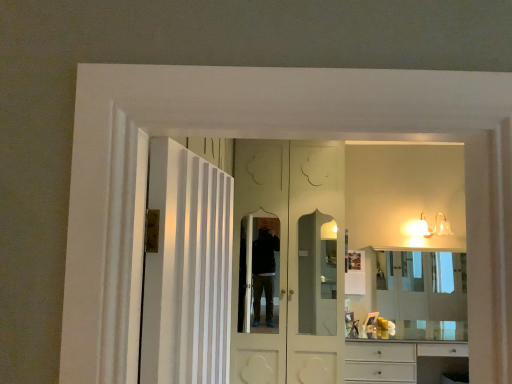
What is the approximate height of white glossy door at center, arranged as the second door when viewed from the back?

It is 33.82 inches.

In order to click on white glossy door at center, arranged as the second door when viewed from the back in this screenshot , I will do `click(187, 270)`.

Measure the distance between white glossy wall sconce at upper right and camera.

A distance of 14.91 feet exists between white glossy wall sconce at upper right and camera.

Identify the location of white glossy door at center, marked as the first door in a front-to-back arrangement. (187, 270).

Between white glossy wall sconce at upper right and white glossy door at center, marked as the first door in a front-to-back arrangement, which one is positioned behind?

white glossy wall sconce at upper right is further away from the camera.

Is white glossy wall sconce at upper right bigger or smaller than white glossy door at center, marked as the first door in a front-to-back arrangement?

Clearly, white glossy wall sconce at upper right is smaller in size than white glossy door at center, marked as the first door in a front-to-back arrangement.

Is white glossy wall sconce at upper right placed right next to white glossy door at center, arranged as the second door when viewed from the back?

They are not placed beside each other.

From a real-world perspective, which object stands above the other?

white glossy wall sconce at upper right.

Can you tell me how much white glossy wall sconce at upper right and white glossy cabinet at lower right differ in facing direction?

white glossy wall sconce at upper right and white glossy cabinet at lower right are facing 0.58 degrees away from each other.

Between white glossy wall sconce at upper right and white glossy cabinet at lower right, which one appears on the right side from the viewer's perspective?

→ white glossy wall sconce at upper right.

Is white glossy wall sconce at upper right bigger than white glossy cabinet at lower right?

No, white glossy wall sconce at upper right is not bigger than white glossy cabinet at lower right.

Does white glossy wall sconce at upper right have a greater height compared to white glossy door at center, which is the 2th door in front-to-back order?

Incorrect, the height of white glossy wall sconce at upper right is not larger of that of white glossy door at center, which is the 2th door in front-to-back order.

Is white glossy wall sconce at upper right next to white glossy door at center, the first door when ordered from back to front?

They are not placed beside each other.

From the image's perspective, which one is positioned higher, white glossy wall sconce at upper right or white glossy door at center, which is the 2th door in front-to-back order?

From the image's view, white glossy wall sconce at upper right is above.

Can you see white glossy door at center, which is the 2th door in front-to-back order, touching white glossy door at center, arranged as the second door when viewed from the back?

white glossy door at center, which is the 2th door in front-to-back order, is not next to white glossy door at center, arranged as the second door when viewed from the back, and they're not touching.

Is white glossy door at center, which is the 2th door in front-to-back order, facing towards white glossy door at center, marked as the first door in a front-to-back arrangement?

Yes.

Based on their sizes in the image, would you say white glossy door at center, which is the 2th door in front-to-back order, is bigger or smaller than white glossy door at center, marked as the first door in a front-to-back arrangement?

white glossy door at center, which is the 2th door in front-to-back order, is bigger than white glossy door at center, marked as the first door in a front-to-back arrangement.

Is white glossy wall sconce at upper right oriented towards clear glass mirror at center?

No, white glossy wall sconce at upper right does not turn towards clear glass mirror at center.

From the image's perspective, does white glossy wall sconce at upper right appear higher than clear glass mirror at center?

Yes, from the image's perspective, white glossy wall sconce at upper right is on top of clear glass mirror at center.

Is white glossy wall sconce at upper right inside the boundaries of clear glass mirror at center, or outside?

white glossy wall sconce at upper right is not enclosed by clear glass mirror at center.

Could you measure the distance between white glossy door at center, which is the 2th door in front-to-back order, and clear glass mirror at center?

white glossy door at center, which is the 2th door in front-to-back order, is 37.22 inches from clear glass mirror at center.

How many degrees apart are the facing directions of white glossy door at center, the first door when ordered from back to front, and clear glass mirror at center?

There is a 0.396-degree angle between the facing directions of white glossy door at center, the first door when ordered from back to front, and clear glass mirror at center.

Considering the positions of points (337, 283) and (435, 260), is point (337, 283) farther from camera compared to point (435, 260)?

That is False.

Consider the image. Between white glossy door at center, the first door when ordered from back to front, and clear glass mirror at center, which one has less height?

Standing shorter between the two is clear glass mirror at center.

Does clear glass mirror at center contain white glossy door at center, marked as the first door in a front-to-back arrangement?

No, white glossy door at center, marked as the first door in a front-to-back arrangement, is not inside clear glass mirror at center.

From the picture: From the image's perspective, is clear glass mirror at center above or below white glossy door at center, marked as the first door in a front-to-back arrangement?

clear glass mirror at center is situated lower than white glossy door at center, marked as the first door in a front-to-back arrangement, in the image.

From the white glossy wall sconce at upper right, count 2nd doors forward and point to it. Please provide its 2D coordinates.

[(187, 270)]

This screenshot has width=512, height=384. Identify the location of cabinetry below the white glossy wall sconce at upper right (from the image's perspective). (403, 361).

Estimate the real-world distances between objects in this image. Which object is closer to clear glass mirror at center, white glossy door at center, marked as the first door in a front-to-back arrangement, or white glossy door at center, the first door when ordered from back to front?

white glossy door at center, the first door when ordered from back to front.

Based on their spatial positions, is white glossy cabinet at lower right or white glossy wall sconce at upper right closer to white glossy door at center, arranged as the second door when viewed from the back?

Among the two, white glossy cabinet at lower right is located nearer to white glossy door at center, arranged as the second door when viewed from the back.

Based on their spatial positions, is white glossy cabinet at lower right or white glossy wall sconce at upper right closer to white glossy door at center, the first door when ordered from back to front?

white glossy cabinet at lower right is positioned closer to the anchor white glossy door at center, the first door when ordered from back to front.

Considering their positions, is white glossy door at center, marked as the first door in a front-to-back arrangement, positioned further to clear glass mirror at center than white glossy cabinet at lower right?

white glossy door at center, marked as the first door in a front-to-back arrangement.

Which object lies further to the anchor point white glossy door at center, which is the 2th door in front-to-back order, white glossy wall sconce at upper right or white glossy cabinet at lower right?

Among the two, white glossy wall sconce at upper right is located further to white glossy door at center, which is the 2th door in front-to-back order.

Estimate the real-world distances between objects in this image. Which object is further from clear glass mirror at center, white glossy wall sconce at upper right or white glossy door at center, the first door when ordered from back to front?

The object further to clear glass mirror at center is white glossy door at center, the first door when ordered from back to front.

When comparing their distances from white glossy door at center, the first door when ordered from back to front, does clear glass mirror at center or white glossy door at center, arranged as the second door when viewed from the back, seem closer?

Based on the image, clear glass mirror at center appears to be nearer to white glossy door at center, the first door when ordered from back to front.

From the image, which object appears to be farther from white glossy door at center, arranged as the second door when viewed from the back, white glossy wall sconce at upper right or white glossy door at center, the first door when ordered from back to front?

white glossy wall sconce at upper right.

Where is `light fixture located between white glossy door at center, marked as the first door in a front-to-back arrangement, and clear glass mirror at center in the depth direction`? This screenshot has width=512, height=384. light fixture located between white glossy door at center, marked as the first door in a front-to-back arrangement, and clear glass mirror at center in the depth direction is located at coordinates (430, 229).

Where is `cabinetry between white glossy door at center, the first door when ordered from back to front, and clear glass mirror at center, in the horizontal direction`? cabinetry between white glossy door at center, the first door when ordered from back to front, and clear glass mirror at center, in the horizontal direction is located at coordinates (403, 361).

This screenshot has width=512, height=384. Find the location of `door located between white glossy door at center, arranged as the second door when viewed from the back, and clear glass mirror at center in the depth direction`. door located between white glossy door at center, arranged as the second door when viewed from the back, and clear glass mirror at center in the depth direction is located at coordinates (291, 261).

Identify the location of mirror between white glossy wall sconce at upper right and white glossy cabinet at lower right vertically. The width and height of the screenshot is (512, 384). (414, 294).